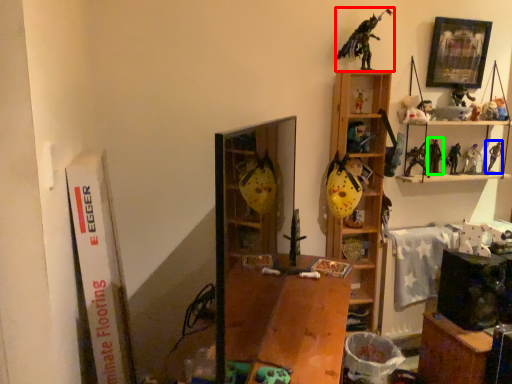
Question: Which object is positioned farthest from toy (highlighted by a red box)? Select from toy (highlighted by a blue box) and toy (highlighted by a green box).

Choices:
 (A) toy
 (B) toy

Answer: (A)